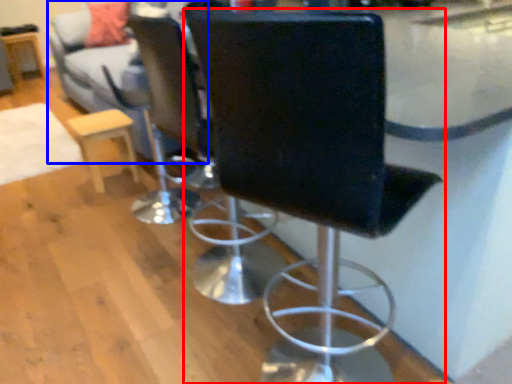
Question: Which object appears closest to the camera in this image, chair (highlighted by a red box) or couch (highlighted by a blue box)?

Choices:
 (A) chair
 (B) couch

Answer: (A)